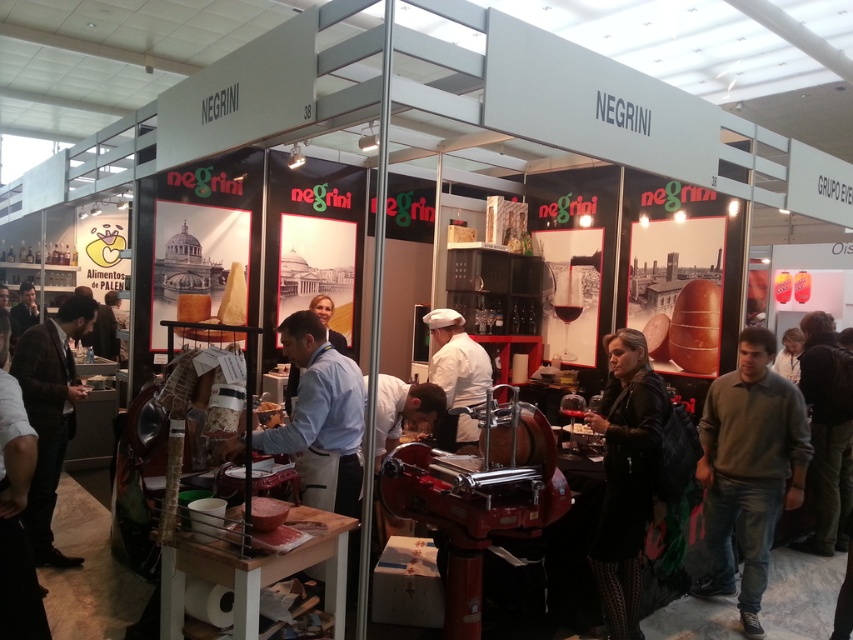
Question: Which point is farther to the camera?

Choices:
 (A) (809, 396)
 (B) (746, 547)

Answer: (A)

Question: Is gray sweater at right to the right of dark brown leather jacket at lower right from the viewer's perspective?

Choices:
 (A) no
 (B) yes

Answer: (A)

Question: Which point is closer to the camera?

Choices:
 (A) (843, 468)
 (B) (38, 413)

Answer: (B)

Question: Is gray sweater at right positioned at the back of dark brown leather jacket at lower right?

Choices:
 (A) no
 (B) yes

Answer: (A)

Question: Where is black leather jacket at center located in relation to brown wool jacket at lower left in the image?

Choices:
 (A) left
 (B) right

Answer: (B)

Question: Estimate the real-world distances between objects in this image. Which object is closer to the gray sweater at right?

Choices:
 (A) dark brown leather jacket at lower right
 (B) black leather jacket at center

Answer: (B)